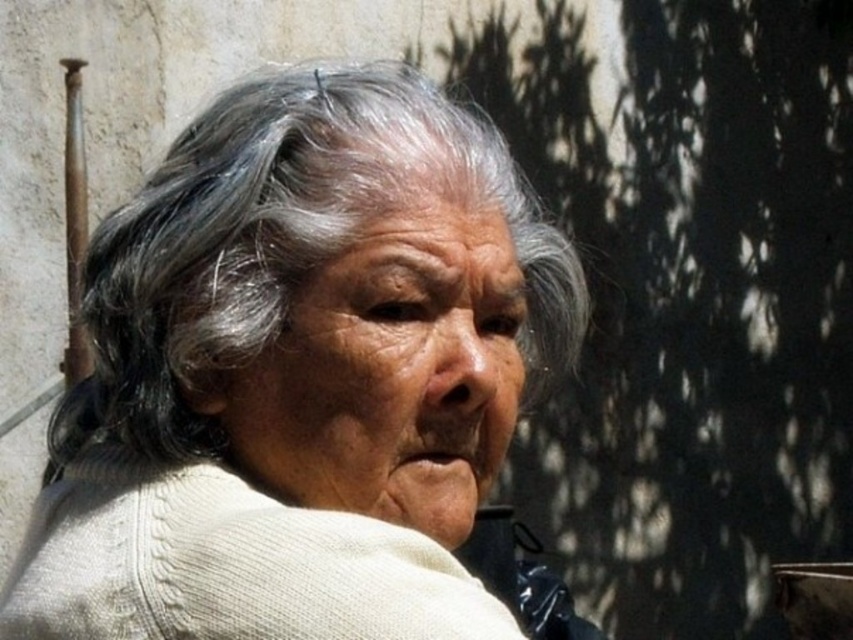
Question: Is gray matte hair at center above white knitted sweater at center?

Choices:
 (A) no
 (B) yes

Answer: (B)

Question: Which object appears closest to the camera in this image?

Choices:
 (A) gray matte hair at center
 (B) white knitted sweater at center

Answer: (B)

Question: Observing the image, what is the correct spatial positioning of gray matte hair at center in reference to white knitted sweater at center?

Choices:
 (A) above
 (B) below

Answer: (A)

Question: Which object appears closest to the camera in this image?

Choices:
 (A) white knitted sweater at center
 (B) gray matte hair at center

Answer: (A)

Question: Does gray matte hair at center come behind white knitted sweater at center?

Choices:
 (A) yes
 (B) no

Answer: (A)